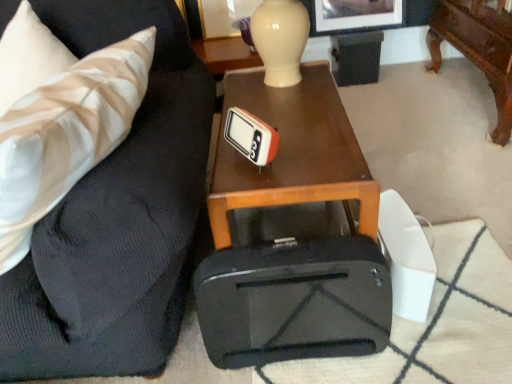
The height and width of the screenshot is (384, 512). Find the location of `free space above black matte suitcase at center (from a real-world perspective)`. free space above black matte suitcase at center (from a real-world perspective) is located at coordinates (293, 253).